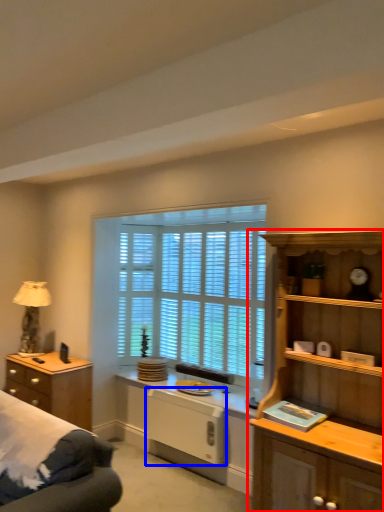
Question: Which of the following is the farthest to the observer, cabinetry (highlighted by a red box) or appliance (highlighted by a blue box)?

Choices:
 (A) cabinetry
 (B) appliance

Answer: (B)